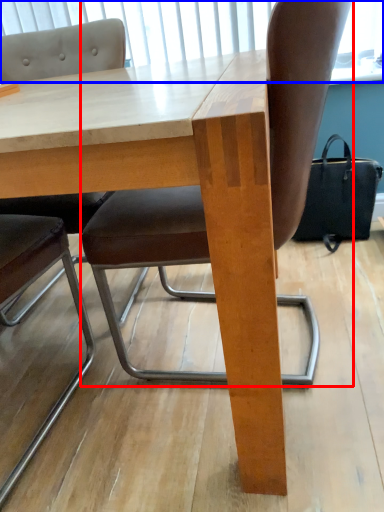
Question: Among these objects, which one is farthest to the camera, chair (highlighted by a red box) or window screen (highlighted by a blue box)?

Choices:
 (A) chair
 (B) window screen

Answer: (B)